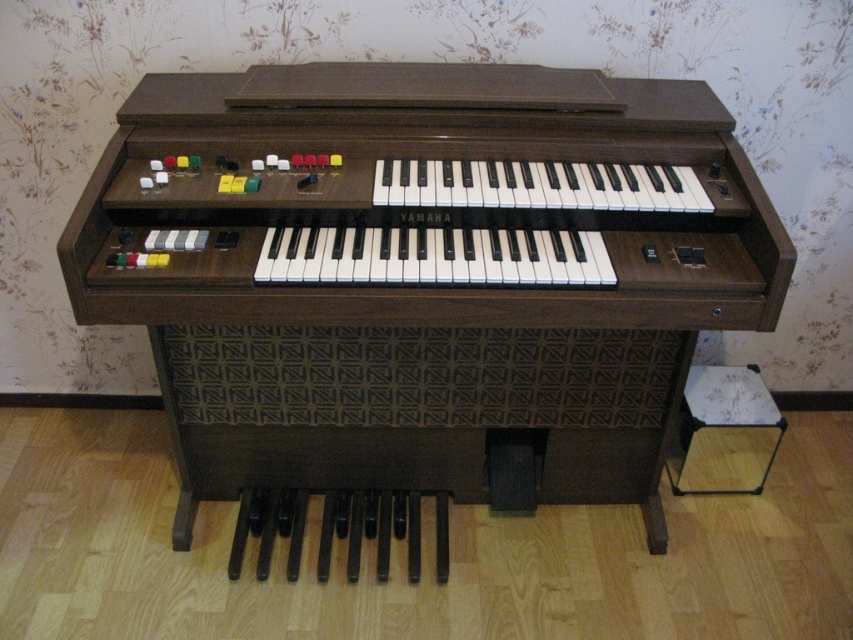
Question: Which object appears closest to the camera in this image?

Choices:
 (A) wooden piano at center
 (B) white glossy stool at lower right

Answer: (A)

Question: Observing the image, what is the correct spatial positioning of wooden piano at center in reference to white glossy stool at lower right?

Choices:
 (A) below
 (B) above

Answer: (B)

Question: Is wooden piano at center below white glossy stool at lower right?

Choices:
 (A) yes
 (B) no

Answer: (B)

Question: Observing the image, what is the correct spatial positioning of wooden piano at center in reference to white glossy stool at lower right?

Choices:
 (A) below
 (B) above

Answer: (B)